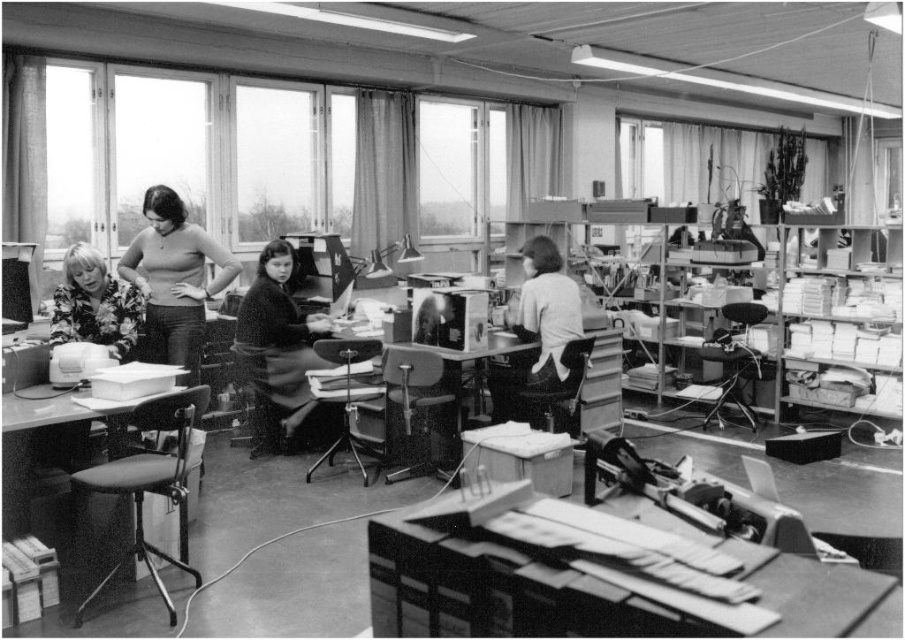
In the scene shown: You are an office worker in this vintage office. You need to hang both the dark fabric coat at center and the floral fabric blouse at left on a single hanger. Can you fit both on the same hanger without overlapping?

The dark fabric coat at center is larger in size than the floral fabric blouse at left. Since the coat is bigger, it might require more space on the hanger. However, without knowing the exact size of the hanger, it is uncertain if both can fit without overlapping. Please check the hanger size first.

You are an office worker in this vintage office setting. You notice a dark fabric coat at center and a light gray fabric shirt at center. Which clothing item is closer to the floor?

The dark fabric coat at center is positioned under the light gray fabric shirt at center, so it is closer to the floor.

You are standing in the vintage office and want to reach both the point at coordinates point [178,240] and the point at coordinates point [549,364]. Which point is closer to you?

Point [178,240] is closer to you because it is further to the camera than point [549,364], meaning it is nearer in the scene.